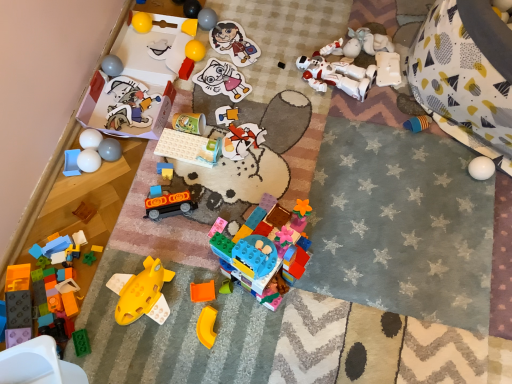
Question: Does yellow matte block at center, which appears as the 13th toy when viewed from the right, come in front of white matte robot at center, which is counted as the 21th toy, starting from the left?

Choices:
 (A) no
 (B) yes

Answer: (A)

Question: Is yellow matte block at center, which is counted as the eleventh toy, starting from the left, to the left of white matte robot at center, which is counted as the 21th toy, starting from the left, from the viewer's perspective?

Choices:
 (A) yes
 (B) no

Answer: (A)

Question: Is yellow matte block at center, which appears as the 13th toy when viewed from the right, not near white matte robot at center, marked as the third toy in a right-to-left arrangement?

Choices:
 (A) no
 (B) yes

Answer: (A)

Question: From a real-world perspective, is yellow matte block at center, which appears as the 13th toy when viewed from the right, under white matte robot at center, which is counted as the 21th toy, starting from the left?

Choices:
 (A) no
 (B) yes

Answer: (B)

Question: Is yellow matte block at center, which is counted as the eleventh toy, starting from the left, in contact with white matte robot at center, marked as the third toy in a right-to-left arrangement?

Choices:
 (A) no
 (B) yes

Answer: (A)

Question: From a real-world perspective, relative to white glossy ball at left, marked as the fifth toy in a left-to-right arrangement, is translucent blue plastic blocks at lower left, which appears as the 23th toy when viewed from the right, vertically above or below?

Choices:
 (A) above
 (B) below

Answer: (B)

Question: Is translucent blue plastic blocks at lower left, the first toy from the left, wider or thinner than white glossy ball at left, the nineteenth toy in the right-to-left sequence?

Choices:
 (A) wide
 (B) thin

Answer: (A)

Question: Visually, is translucent blue plastic blocks at lower left, which appears as the 23th toy when viewed from the right, positioned to the left or to the right of white glossy ball at left, the nineteenth toy in the right-to-left sequence?

Choices:
 (A) right
 (B) left

Answer: (B)

Question: Considering their positions, is translucent blue plastic blocks at lower left, which appears as the 23th toy when viewed from the right, located in front of or behind white glossy ball at left, the nineteenth toy in the right-to-left sequence?

Choices:
 (A) behind
 (B) front

Answer: (B)

Question: Considering the positions of white plastic robot at upper right, arranged as the 22th toy when viewed from the left, and matte plastic sticker at upper center, which is the 20th toy from left to right, in the image, is white plastic robot at upper right, arranged as the 22th toy when viewed from the left, wider or thinner than matte plastic sticker at upper center, which is the 20th toy from left to right,?

Choices:
 (A) wide
 (B) thin

Answer: (B)

Question: Relative to matte plastic sticker at upper center, which is the 20th toy from left to right, is white plastic robot at upper right, arranged as the 22th toy when viewed from the left, in front or behind?

Choices:
 (A) front
 (B) behind

Answer: (A)

Question: Would you say white plastic robot at upper right, which appears as the second toy when viewed from the right, is to the left or to the right of matte plastic sticker at upper center, marked as the fourth toy in a right-to-left arrangement, in the picture?

Choices:
 (A) left
 (B) right

Answer: (B)

Question: Choose the correct answer: Is white plastic robot at upper right, arranged as the 22th toy when viewed from the left, inside matte plastic sticker at upper center, marked as the fourth toy in a right-to-left arrangement, or outside it?

Choices:
 (A) outside
 (B) inside

Answer: (A)

Question: From the image's perspective, is translucent orange plastic at center, the fifth toy in the right-to-left sequence, located above or below wooden block at lower left, the 3th toy from the left?

Choices:
 (A) below
 (B) above

Answer: (A)

Question: Is point [224, 289] positioned closer to the camera than point [89, 216]?

Choices:
 (A) closer
 (B) farther

Answer: (A)